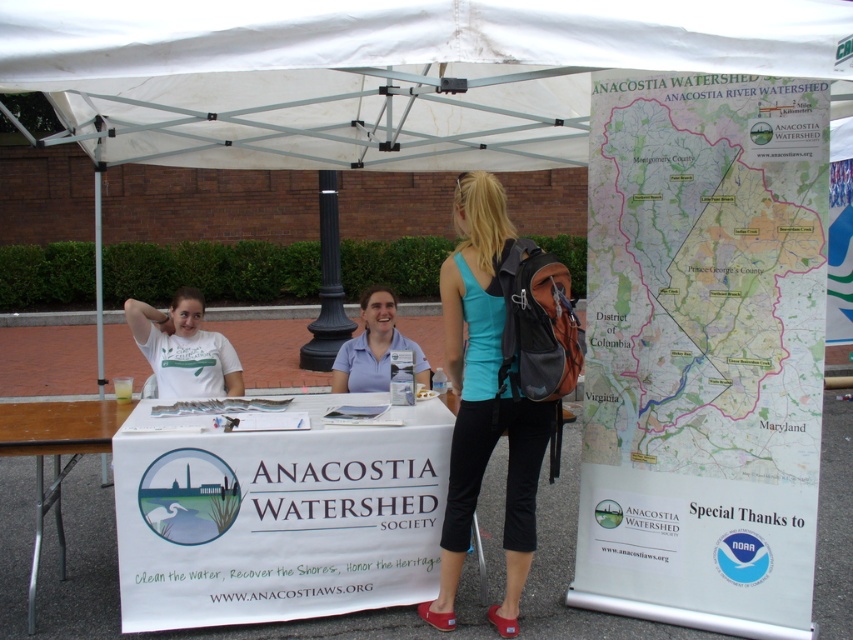
Is point (119, 144) more distant than point (483, 180)?

Yes, it is.

Which is behind, point (759, 19) or point (445, 557)?

Positioned behind is point (445, 557).

The image size is (853, 640). Find the location of `white fabric canopy at upper center`. white fabric canopy at upper center is located at coordinates (381, 74).

Which is more to the left, teal fabric tank top at center or blue cotton shirt at center?

blue cotton shirt at center is more to the left.

Can you confirm if teal fabric tank top at center is positioned below blue cotton shirt at center?

Indeed, teal fabric tank top at center is positioned under blue cotton shirt at center.

Does point (471, 444) come farther from viewer compared to point (413, 342)?

No, (471, 444) is closer to viewer.

This screenshot has width=853, height=640. I want to click on teal fabric tank top at center, so click(x=485, y=401).

Which is in front, point (383, 442) or point (233, 365)?

Point (383, 442)

Between white fabric table at center and matte white t-shirt at left, which one appears on the left side from the viewer's perspective?

Positioned to the left is matte white t-shirt at left.

What do you see at coordinates (277, 515) in the screenshot? I see `white fabric table at center` at bounding box center [277, 515].

At what (x,y) coordinates should I click in order to perform the action: click on white fabric table at center. Please return your answer as a coordinate pair (x, y). This screenshot has width=853, height=640. Looking at the image, I should click on (277, 515).